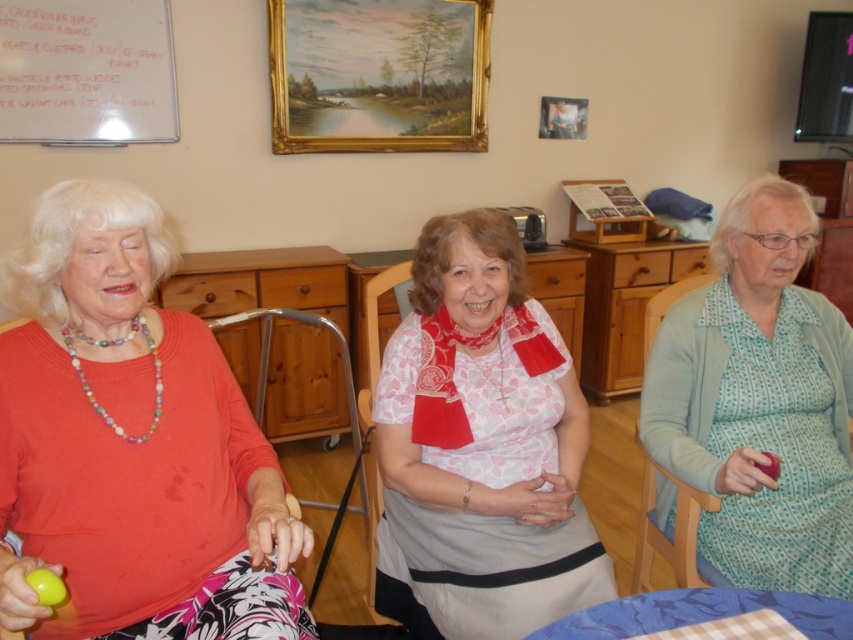
Question: Can you confirm if white cotton blouse at center is bigger than wooden picture frame at upper center?

Choices:
 (A) no
 (B) yes

Answer: (B)

Question: Is white cotton blouse at center positioned before light blue dotted cardigan at right?

Choices:
 (A) yes
 (B) no

Answer: (B)

Question: Does white cotton blouse at center have a lesser width compared to gold/gilded picture frame at upper center?

Choices:
 (A) no
 (B) yes

Answer: (B)

Question: Which point is closer to the camera taking this photo?

Choices:
 (A) (144, 512)
 (B) (132, 104)

Answer: (A)

Question: Which of the following is the closest to the observer?

Choices:
 (A) [341, 49]
 (B) [96, 442]
 (C) [567, 118]

Answer: (B)

Question: Which object is closer to the camera taking this photo?

Choices:
 (A) white cotton blouse at center
 (B) light blue dotted cardigan at right
 (C) gold/gilded picture frame at upper center
 (D) wooden picture frame at upper center

Answer: (B)